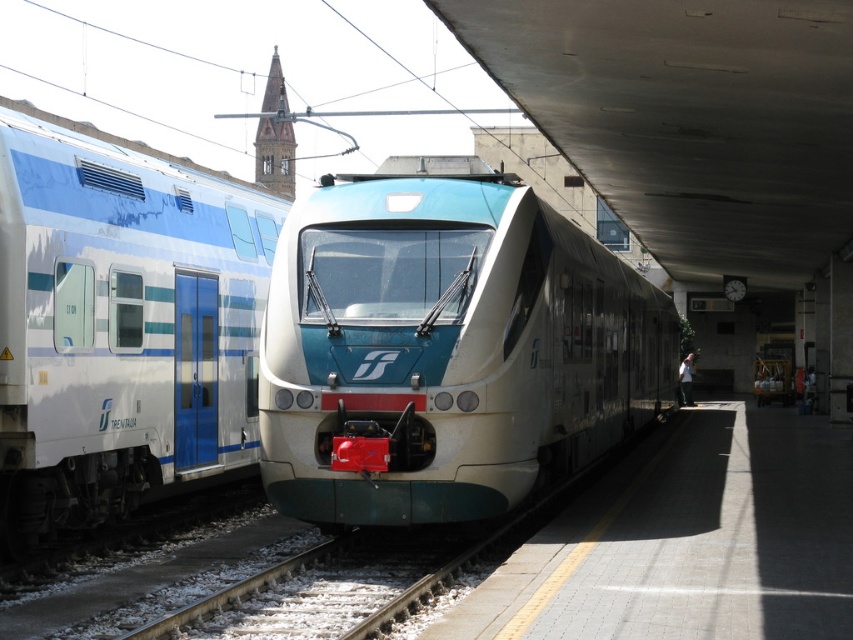
Which is more to the left, white tile platform at center or white gravel at lower center?

From the viewer's perspective, white gravel at lower center appears more on the left side.

Between point (828, 474) and point (292, 628), which one is positioned in front?

Positioned in front is point (292, 628).

Where is `white tile platform at center`? The height and width of the screenshot is (640, 853). white tile platform at center is located at coordinates (688, 541).

Can you confirm if matte white train at center is positioned to the left of white tile platform at center?

Indeed, matte white train at center is positioned on the left side of white tile platform at center.

Between point (303, 460) and point (695, 506), which one is positioned behind?

The point (695, 506) is behind.

Who is more forward, [317,236] or [848,541]?

Point [848,541] is in front.

You are a GUI agent. You are given a task and a screenshot of the screen. Output one action in this format:
    pyautogui.click(x=<x>, y=<y>)
    Task: Click on the matte white train at center
    The height and width of the screenshot is (640, 853).
    Given the screenshot: What is the action you would take?
    [445, 349]

Can you confirm if matte white train at center is smaller than white glossy train car at left?

Actually, matte white train at center might be larger than white glossy train car at left.

Is matte white train at center behind white glossy train car at left?

Yes, it is behind white glossy train car at left.

Is point (498, 252) farther from viewer compared to point (115, 205)?

No, it is not.

Locate an element on the screen. This screenshot has width=853, height=640. matte white train at center is located at coordinates (445, 349).